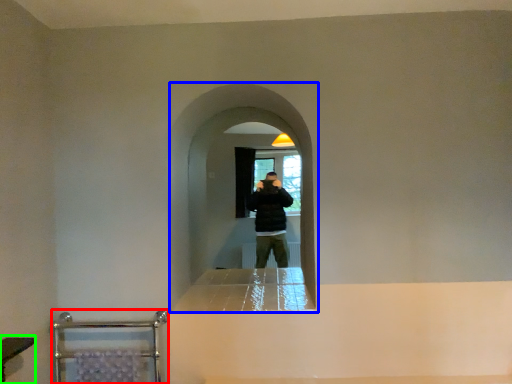
Question: Which object is positioned farthest from balustrade (highlighted by a red box)? Select from screen door (highlighted by a blue box) and vanity (highlighted by a green box).

Choices:
 (A) screen door
 (B) vanity

Answer: (A)